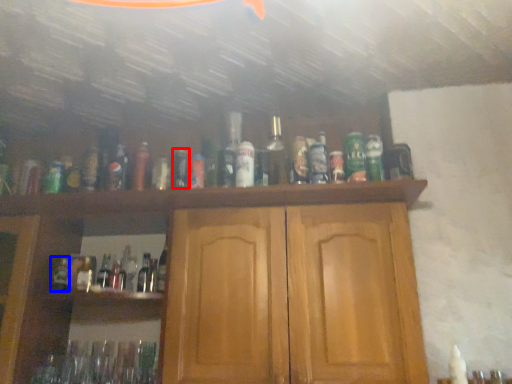
Question: Which object is closer to the camera taking this photo, bottle (highlighted by a red box) or bottle (highlighted by a blue box)?

Choices:
 (A) bottle
 (B) bottle

Answer: (A)